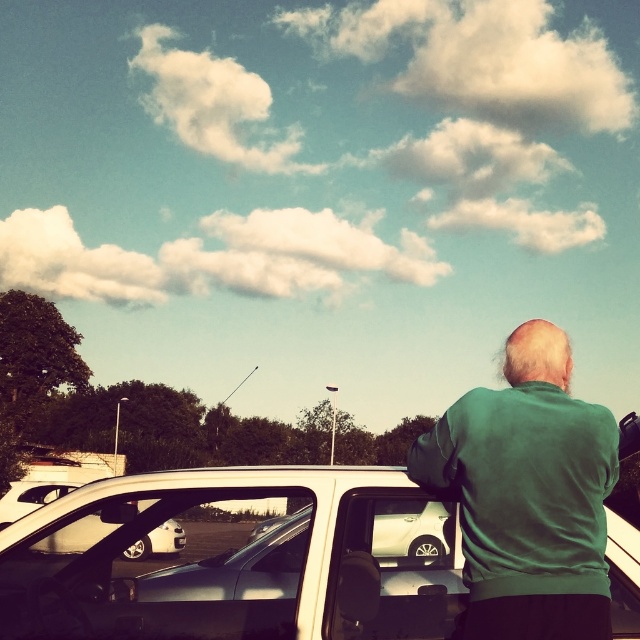
Identify the location of white matte car at center. This screenshot has height=640, width=640. (236, 557).

Which is below, white matte car at center or green matte jacket at upper right?

white matte car at center is lower down.

At what (x,y) coordinates should I click in order to perform the action: click on white matte car at center. Please return your answer as a coordinate pair (x, y). Looking at the image, I should click on (236, 557).